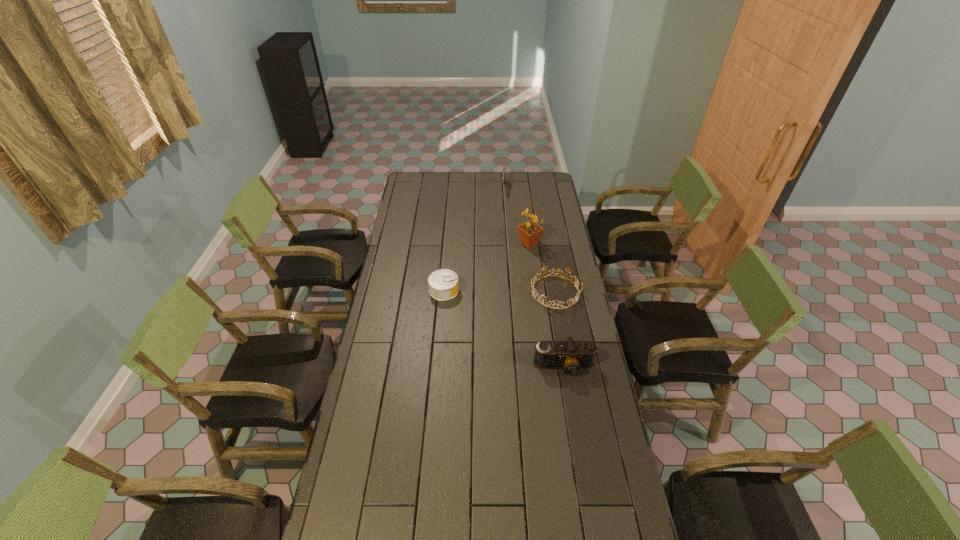
The image size is (960, 540). Identify the location of the leftmost object. coord(443,284).

Find the location of `camera`. camera is located at coordinates (571, 356).

In order to click on the fourth object from right to left in this screenshot , I will do `click(504, 168)`.

At what (x,y) coordinates should I click in order to perform the action: click on pistol. Please return your answer as a coordinate pair (x, y). This screenshot has height=540, width=960. Looking at the image, I should click on (504, 168).

At what (x,y) coordinates should I click in order to perform the action: click on tiara. Please return your answer as a coordinate pair (x, y). Image resolution: width=960 pixels, height=540 pixels. Looking at the image, I should click on (534, 294).

The height and width of the screenshot is (540, 960). Identify the location of the tallest object. (530, 233).

In order to click on sunflower in this screenshot , I will do `click(530, 233)`.

This screenshot has width=960, height=540. I want to click on free space located 0.210m on the front of the can, so click(x=440, y=338).

Where is `vacant region located on the lens of the camera`? Image resolution: width=960 pixels, height=540 pixels. vacant region located on the lens of the camera is located at coordinates (583, 482).

The image size is (960, 540). I want to click on free space located 0.260m at the barrel of the pistol, so click(501, 221).